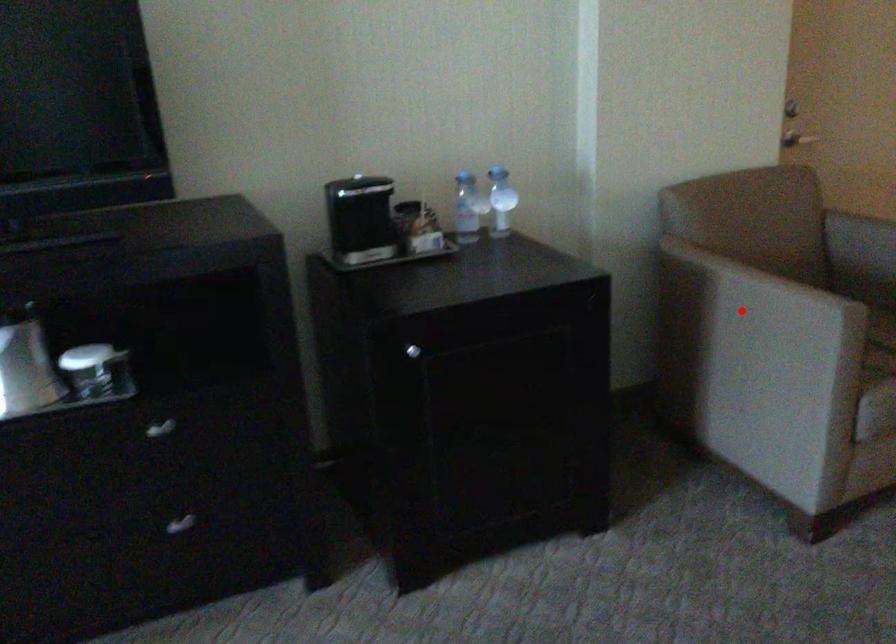
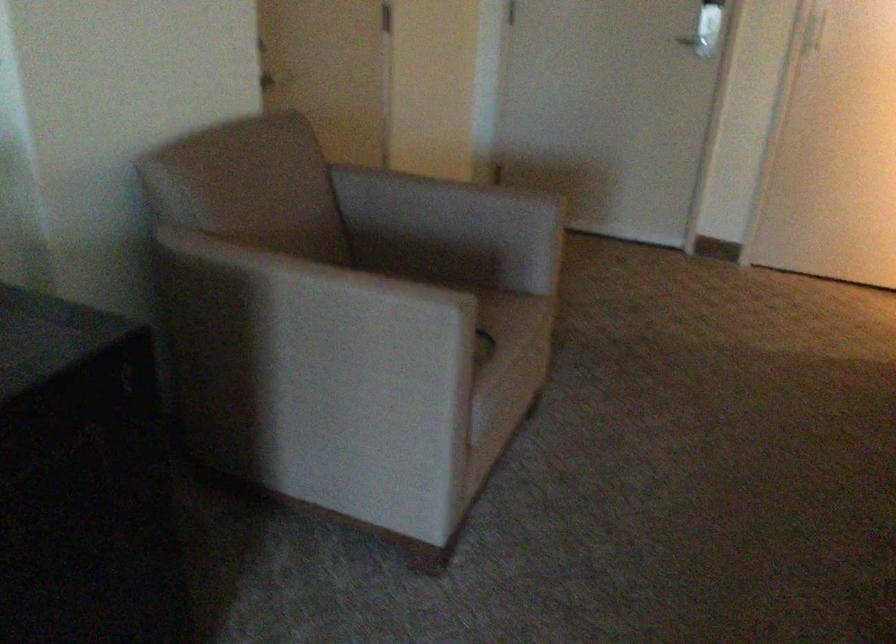
Question: I am providing you with two images of the same scene from different viewpoints. In image1, a red point is highlighted. Considering the same 3D point in image2, which of the following is correct?

Choices:
 (A) It is closer
 (B) It is farther

Answer: (A)